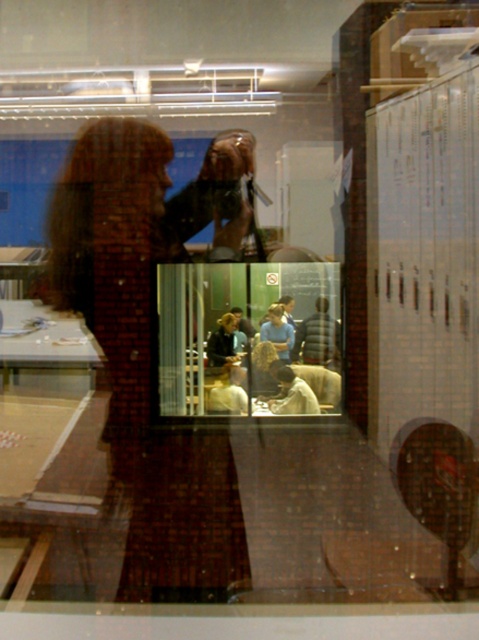
Question: Which object is farther from the camera taking this photo?

Choices:
 (A) dark gray jacket at center
 (B) transparent glass door at center

Answer: (A)

Question: Is transparent glass door at center bigger than dark gray jacket at center?

Choices:
 (A) no
 (B) yes

Answer: (B)

Question: Is transparent glass door at center closer to camera compared to dark gray jacket at center?

Choices:
 (A) no
 (B) yes

Answer: (B)

Question: Does transparent glass door at center appear on the right side of dark gray jacket at center?

Choices:
 (A) no
 (B) yes

Answer: (A)

Question: Which point is closer to the camera taking this photo?

Choices:
 (A) (212, 392)
 (B) (338, 324)

Answer: (B)